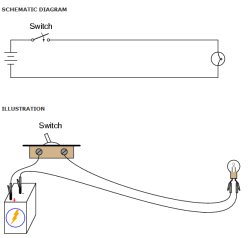
The height and width of the screenshot is (238, 250). Identify the location of wires. (28, 165), (55, 175), (93, 170), (140, 189).